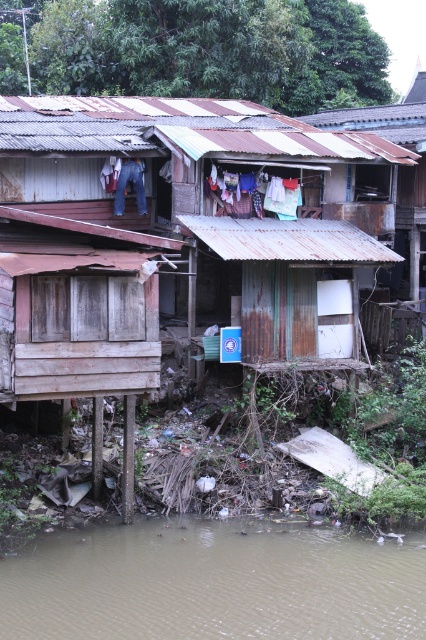
Question: Observing the image, what is the correct spatial positioning of rusty corrugated metal hut at center in reference to brown muddy water at lower center?

Choices:
 (A) left
 (B) right

Answer: (A)

Question: Which of the following is the closest to the observer?

Choices:
 (A) 250,563
 (B) 250,192

Answer: (A)

Question: Which point is farther to the camera?

Choices:
 (A) (135, 316)
 (B) (227, 200)
 (C) (317, 605)

Answer: (B)

Question: In this image, where is rusty corrugated metal hut at center located relative to brown muddy water at lower center?

Choices:
 (A) right
 (B) left

Answer: (B)

Question: Which point appears farthest from the camera in this image?

Choices:
 (A) (241, 170)
 (B) (252, 602)

Answer: (A)

Question: Can you confirm if brown muddy water at lower center is positioned below white fabric at center?

Choices:
 (A) yes
 (B) no

Answer: (A)